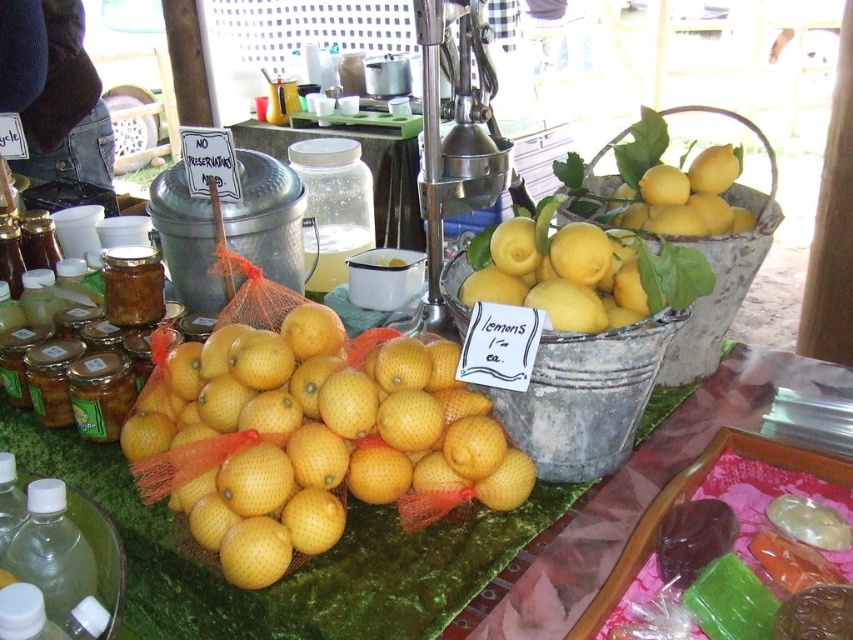
Is yellow matte lemons at center to the left of clear plastic bottle at lower left from the viewer's perspective?

No, yellow matte lemons at center is not to the left of clear plastic bottle at lower left.

Consider the image. Does yellow matte lemons at center have a lesser height compared to clear plastic bottle at lower left?

No, yellow matte lemons at center is not shorter than clear plastic bottle at lower left.

At what (x,y) coordinates should I click in order to perform the action: click on yellow matte lemons at center. Please return your answer as a coordinate pair (x, y). Image resolution: width=853 pixels, height=640 pixels. Looking at the image, I should click on (318, 440).

Can you confirm if clear glass jar at center is positioned to the right of clear plastic bottle at lower left?

Yes, clear glass jar at center is to the right of clear plastic bottle at lower left.

Which is in front, point (321, 243) or point (56, 563)?

Point (56, 563)

You are a GUI agent. You are given a task and a screenshot of the screen. Output one action in this format:
    pyautogui.click(x=<x>, y=<y>)
    Task: Click on the clear glass jar at center
    The image size is (853, 640).
    Given the screenshot: What is the action you would take?
    pyautogui.click(x=334, y=205)

Does yellow matte lemons at center come behind clear glass jar at center?

No.

Is yellow matte lemons at center to the right of clear glass jar at center from the viewer's perspective?

Correct, you'll find yellow matte lemons at center to the right of clear glass jar at center.

Does point (187, 356) come farther from viewer compared to point (322, 273)?

No.

This screenshot has height=640, width=853. Find the location of `yellow matte lemons at center`. yellow matte lemons at center is located at coordinates (318, 440).